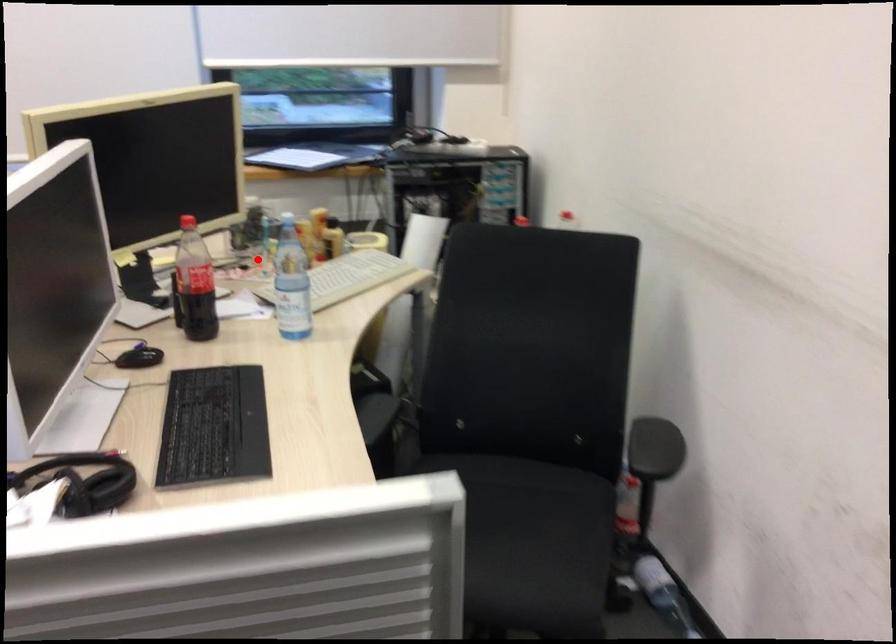
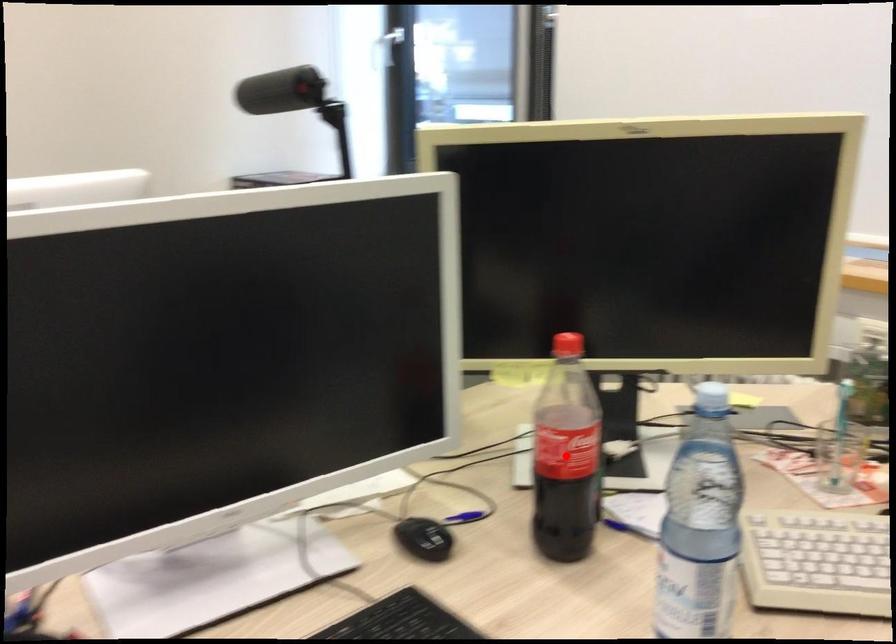
I am providing you with two images of the same scene from different viewpoints. A red point is marked on the first image and another point is marked on the second image. Are the points marked in image1 and image2 representing the same 3D position?

No